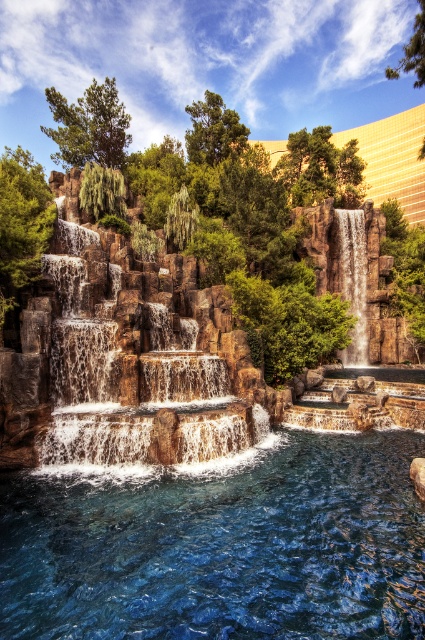
Question: Is translucent blue water at center to the right of smooth stone waterfall at center from the viewer's perspective?

Choices:
 (A) yes
 (B) no

Answer: (B)

Question: Estimate the real-world distances between objects in this image. Which object is closer to the smooth stone waterfall at center?

Choices:
 (A) brown textured rock waterfall at center
 (B) yellow/golden glass building at upper center

Answer: (A)

Question: Which object appears closest to the camera in this image?

Choices:
 (A) smooth stone waterfall at center
 (B) translucent blue water at center

Answer: (B)

Question: Among these points, which one is farthest from the camera?

Choices:
 (A) (167, 305)
 (B) (354, 355)
 (C) (404, 141)

Answer: (C)

Question: Is translucent blue water at center bigger than yellow/golden glass building at upper center?

Choices:
 (A) no
 (B) yes

Answer: (A)

Question: Can you confirm if brown textured rock waterfall at center is positioned below yellow/golden glass building at upper center?

Choices:
 (A) no
 (B) yes

Answer: (B)